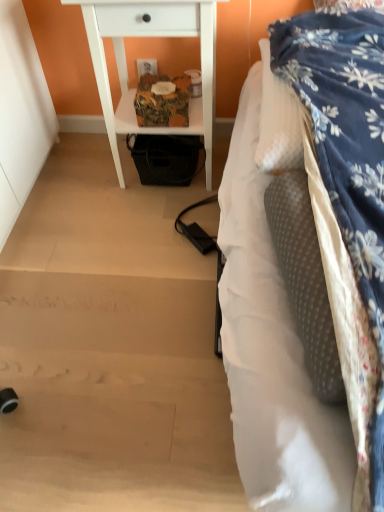
Find the location of a particular element. Image resolution: width=384 pixels, height=512 pixels. white wood nightstand at upper center is located at coordinates (151, 36).

The height and width of the screenshot is (512, 384). What do you see at coordinates (151, 36) in the screenshot?
I see `white wood nightstand at upper center` at bounding box center [151, 36].

You are a GUI agent. You are given a task and a screenshot of the screen. Output one action in this format:
    pyautogui.click(x=<x>, y=<y>)
    Task: Click on the white wood nightstand at upper center
    The width and height of the screenshot is (384, 512).
    Given the screenshot: What is the action you would take?
    tap(151, 36)